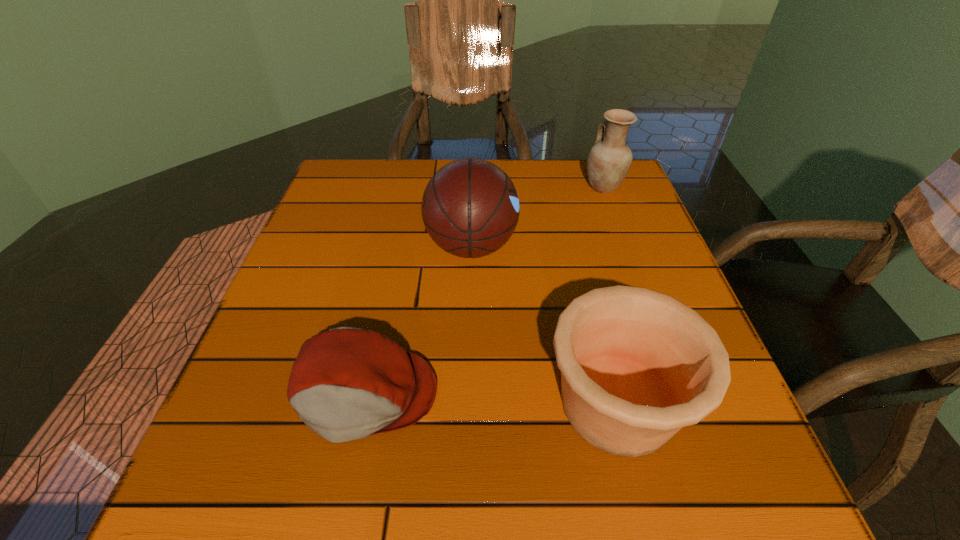
The image size is (960, 540). In order to click on empty location between the taller pottery and the basketball in this screenshot , I will do `click(538, 217)`.

Image resolution: width=960 pixels, height=540 pixels. What are the coordinates of `free space between the taller pottery and the basketball` in the screenshot? It's located at (538, 217).

Identify the location of free area in between the second shortest object and the shortest object. (492, 399).

Where is `unoccupied position between the basketball and the cap`? The image size is (960, 540). unoccupied position between the basketball and the cap is located at coordinates (419, 320).

The image size is (960, 540). Find the location of `free point between the shortest object and the taller pottery`. free point between the shortest object and the taller pottery is located at coordinates (485, 291).

At what (x,y) coordinates should I click in order to perform the action: click on unoccupied position between the shortest object and the farther pottery. Please return your answer as a coordinate pair (x, y). The image size is (960, 540). Looking at the image, I should click on (485, 291).

Where is `unoccupied area between the basketball and the shortest object`? unoccupied area between the basketball and the shortest object is located at coordinates (419, 320).

In order to click on free spot between the farthest object and the second farthest object in this screenshot , I will do `click(538, 217)`.

The image size is (960, 540). Find the location of `object that is the second nearest to the nearer pottery`. object that is the second nearest to the nearer pottery is located at coordinates (347, 383).

Select which object is the third closest to the second farthest object. Please provide its 2D coordinates. Your answer should be formatted as a tuple, i.e. [(x, y)], where the tuple contains the x and y coordinates of a point satisfying the conditions above.

[(609, 161)]